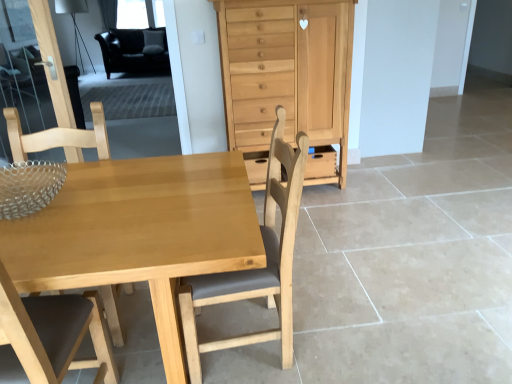
Find the location of `transparent glass door at upper left`. transparent glass door at upper left is located at coordinates (31, 75).

The height and width of the screenshot is (384, 512). I want to click on natural wood chest of drawers at center, so click(287, 71).

What is the approximate width of light brown wood chair at center, the 2th chair from the left?

light brown wood chair at center, the 2th chair from the left, is 20.00 inches wide.

This screenshot has height=384, width=512. What do you see at coordinates (58, 136) in the screenshot?
I see `light brown wood chair at left, the first chair from the left` at bounding box center [58, 136].

I want to click on transparent glass door at upper left, so click(x=31, y=75).

From the picture: Considering the positions of objects black leather armchair at upper left and light brown wood chair at center, which ranks as the first chair in right-to-left order, in the image provided, who is more to the right, black leather armchair at upper left or light brown wood chair at center, which ranks as the first chair in right-to-left order,?

Positioned to the right is light brown wood chair at center, which ranks as the first chair in right-to-left order.

From the image's perspective, which one is positioned lower, black leather armchair at upper left or light brown wood chair at center, which ranks as the first chair in right-to-left order?

light brown wood chair at center, which ranks as the first chair in right-to-left order, appears lower in the image.

Consider the image. From a real-world perspective, is black leather armchair at upper left located higher than light brown wood chair at center, the 2th chair from the left?

No.

Could you measure the distance between black leather armchair at upper left and light brown wood chair at center, which ranks as the first chair in right-to-left order?

The distance of black leather armchair at upper left from light brown wood chair at center, which ranks as the first chair in right-to-left order, is 16.84 feet.

Is natural wood chest of drawers at center taller or shorter than light brown wood chair at left, the first chair from the left?

In the image, natural wood chest of drawers at center appears to be taller than light brown wood chair at left, the first chair from the left.

Is natural wood chest of drawers at center positioned with its back to light brown wood chair at left, the first chair from the left?

That's not correct — natural wood chest of drawers at center is not looking away from light brown wood chair at left, the first chair from the left.

Does point (337, 45) come farther from viewer compared to point (117, 308)?

Yes.

From a real-world perspective, is natural wood chest of drawers at center positioned above or below light brown wood chair at left, the first chair from the left?

natural wood chest of drawers at center is above light brown wood chair at left, the first chair from the left.

Is light brown wood chair at left, the first chair from the left, facing away from natural wood chest of drawers at center?

No, light brown wood chair at left, the first chair from the left,'s orientation is not away from natural wood chest of drawers at center.

Visually, is light brown wood chair at left, the 2th chair when ordered from right to left, positioned to the left or to the right of natural wood chest of drawers at center?

Clearly, light brown wood chair at left, the 2th chair when ordered from right to left, is on the left of natural wood chest of drawers at center in the image.

Does light brown wood chair at left, the 2th chair when ordered from right to left, come behind natural wood chest of drawers at center?

That is False.

How distant is light brown wood chair at left, the first chair from the left, from natural wood chest of drawers at center?

light brown wood chair at left, the first chair from the left, is 1.38 meters away from natural wood chest of drawers at center.

Is light brown wood chair at center, which ranks as the first chair in right-to-left order, at the left side of natural wood chest of drawers at center?

Indeed, light brown wood chair at center, which ranks as the first chair in right-to-left order, is positioned on the left side of natural wood chest of drawers at center.

Is light brown wood chair at center, which ranks as the first chair in right-to-left order, beside natural wood chest of drawers at center?

No, light brown wood chair at center, which ranks as the first chair in right-to-left order, is not next to natural wood chest of drawers at center.

Which is less distant, (197, 366) or (273, 64)?

The point (197, 366) is more forward.

In terms of width, does light brown wood chair at center, the 2th chair from the left, look wider or thinner when compared to natural wood chest of drawers at center?

Considering their sizes, light brown wood chair at center, the 2th chair from the left, looks slimmer than natural wood chest of drawers at center.

Considering the positions of objects matte wood drawer at center and transparent glass door at upper left in the image provided, who is more to the left, matte wood drawer at center or transparent glass door at upper left?

Positioned to the left is transparent glass door at upper left.

Looking at this image, could you tell me if matte wood drawer at center is facing transparent glass door at upper left?

No, matte wood drawer at center does not turn towards transparent glass door at upper left.

Can you confirm if matte wood drawer at center is smaller than transparent glass door at upper left?

Yes.

From a real-world perspective, is matte wood drawer at center positioned above or below transparent glass door at upper left?

From a real-world perspective, matte wood drawer at center is physically below transparent glass door at upper left.

What's the angular difference between natural wood chest of drawers at center and light wood table at center's facing directions?

The facing directions of natural wood chest of drawers at center and light wood table at center are 0.881 degrees apart.

At what (x,y) coordinates should I click in order to perform the action: click on kitchen & dining room table below the natural wood chest of drawers at center (from a real-world perspective). Please return your answer as a coordinate pair (x, y). Looking at the image, I should click on (140, 233).

From the image's perspective, is natural wood chest of drawers at center positioned above or below light wood table at center?

Clearly, from the image's perspective, natural wood chest of drawers at center is above light wood table at center.

Is natural wood chest of drawers at center facing away from light wood table at center?

No, light wood table at center is not at the back of natural wood chest of drawers at center.

Which is behind, transparent glass door at upper left or black leather armchair at upper left?

black leather armchair at upper left is behind.

The width and height of the screenshot is (512, 384). Identify the location of glass door on the right of black leather armchair at upper left. (31, 75).

Is transparent glass door at upper left turned away from black leather armchair at upper left?

Absolutely, transparent glass door at upper left is directed away from black leather armchair at upper left.

How distant is transparent glass door at upper left from black leather armchair at upper left?

2.31 meters.

The width and height of the screenshot is (512, 384). I want to click on armchair above the light brown wood chair at center, the 2th chair from the left (from the image's perspective), so click(134, 50).

You are a GUI agent. You are given a task and a screenshot of the screen. Output one action in this format:
    pyautogui.click(x=<x>, y=<y>)
    Task: Click on the chair that is the 1st object located below the natural wood chest of drawers at center (from the image's perspective)
    Image resolution: width=512 pixels, height=384 pixels.
    Given the screenshot: What is the action you would take?
    pyautogui.click(x=58, y=136)

Based on their spatial positions, is black leather armchair at upper left or light brown wood chair at center, the 2th chair from the left, closer to light brown wood chair at left, the first chair from the left?

light brown wood chair at center, the 2th chair from the left.

Considering their positions, is black leather armchair at upper left positioned closer to matte wood drawer at center than light brown wood chair at left, the first chair from the left?

Among the two, light brown wood chair at left, the first chair from the left, is located nearer to matte wood drawer at center.

From the image, which object appears to be farther from black leather armchair at upper left, light brown wood chair at center, the 2th chair from the left, or natural wood chest of drawers at center?

Based on the image, light brown wood chair at center, the 2th chair from the left, appears to be further to black leather armchair at upper left.

Which object lies nearer to the anchor point light brown wood chair at left, the first chair from the left, light wood table at center or matte wood drawer at center?

light wood table at center lies closer to light brown wood chair at left, the first chair from the left, than the other object.

When comparing their distances from light brown wood chair at left, the first chair from the left, does natural wood chest of drawers at center or light wood table at center seem closer?

light wood table at center lies closer to light brown wood chair at left, the first chair from the left, than the other object.

Considering their positions, is light brown wood chair at left, the first chair from the left, positioned closer to matte wood drawer at center than transparent glass door at upper left?

Among the two, light brown wood chair at left, the first chair from the left, is located nearer to matte wood drawer at center.

From the image, which object appears to be farther from black leather armchair at upper left, natural wood chest of drawers at center or light brown wood chair at left, the 2th chair when ordered from right to left?

light brown wood chair at left, the 2th chair when ordered from right to left, is further to black leather armchair at upper left.

Looking at the image, which one is located closer to light wood table at center, matte wood drawer at center or light brown wood chair at center, the 2th chair from the left?

light brown wood chair at center, the 2th chair from the left, is positioned closer to the anchor light wood table at center.

You are a GUI agent. You are given a task and a screenshot of the screen. Output one action in this format:
    pyautogui.click(x=<x>, y=<y>)
    Task: Click on the chest of drawers between transparent glass door at upper left and matte wood drawer at center
    This screenshot has height=384, width=512.
    Given the screenshot: What is the action you would take?
    pyautogui.click(x=287, y=71)

This screenshot has height=384, width=512. I want to click on chair between light brown wood chair at center, the 2th chair from the left, and matte wood drawer at center in the front-back direction, so click(x=58, y=136).

The height and width of the screenshot is (384, 512). Identify the location of kitchen & dining room table between light brown wood chair at left, the 2th chair when ordered from right to left, and light brown wood chair at center, which ranks as the first chair in right-to-left order, in the horizontal direction. (140, 233).

Locate an element on the screen. chest of drawers between light brown wood chair at center, which ranks as the first chair in right-to-left order, and black leather armchair at upper left in the front-back direction is located at coordinates (287, 71).